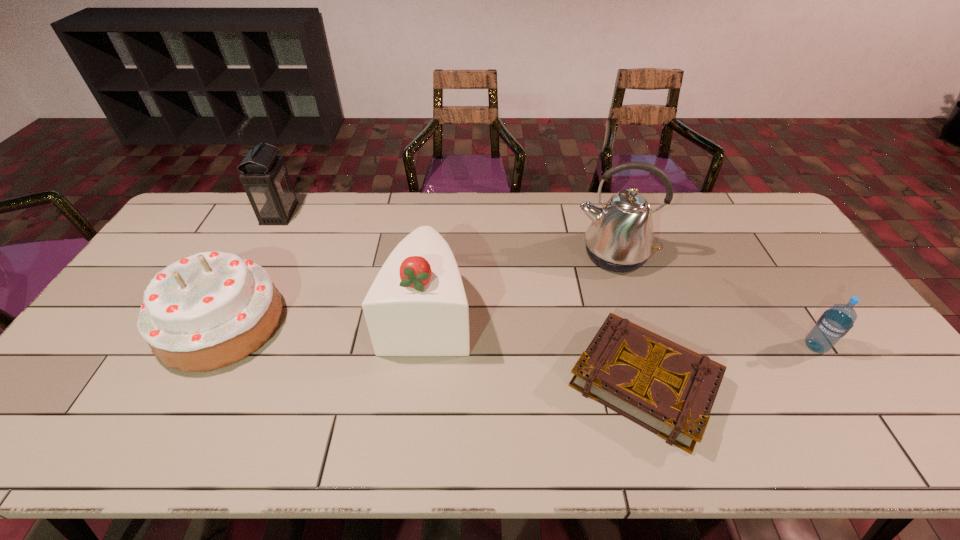
This screenshot has height=540, width=960. Identify the location of free space at the far edge. (664, 222).

Image resolution: width=960 pixels, height=540 pixels. Find the location of `free location at the near edge`. free location at the near edge is located at coordinates (304, 449).

In the image, there is a desktop. Identify the location of vacant space at the left edge. (112, 406).

You are a GUI agent. You are given a task and a screenshot of the screen. Output one action in this format:
    pyautogui.click(x=<x>, y=<y>)
    Task: Click on the vacant space at the right edge of the desktop
    
    Given the screenshot: What is the action you would take?
    pyautogui.click(x=780, y=259)

This screenshot has width=960, height=540. I want to click on vacant space at the far left corner of the desktop, so click(x=181, y=227).

The height and width of the screenshot is (540, 960). What are the coordinates of `free space at the near left corner of the desktop` in the screenshot? It's located at [48, 435].

Where is `free area in between the water bottle and the kettle`? This screenshot has width=960, height=540. free area in between the water bottle and the kettle is located at coordinates (714, 300).

You are a GUI agent. You are given a task and a screenshot of the screen. Output one action in this format:
    pyautogui.click(x=<x>, y=<y>)
    Task: Click on the empty space that is in between the kettle and the third object from left to right
    The height and width of the screenshot is (540, 960).
    Given the screenshot: What is the action you would take?
    pyautogui.click(x=520, y=284)

This screenshot has width=960, height=540. I want to click on empty space that is in between the hardback book and the taller cake, so click(x=536, y=348).

This screenshot has width=960, height=540. Find the location of `vacant area that lies between the farthest object and the rightmost object`. vacant area that lies between the farthest object and the rightmost object is located at coordinates (547, 280).